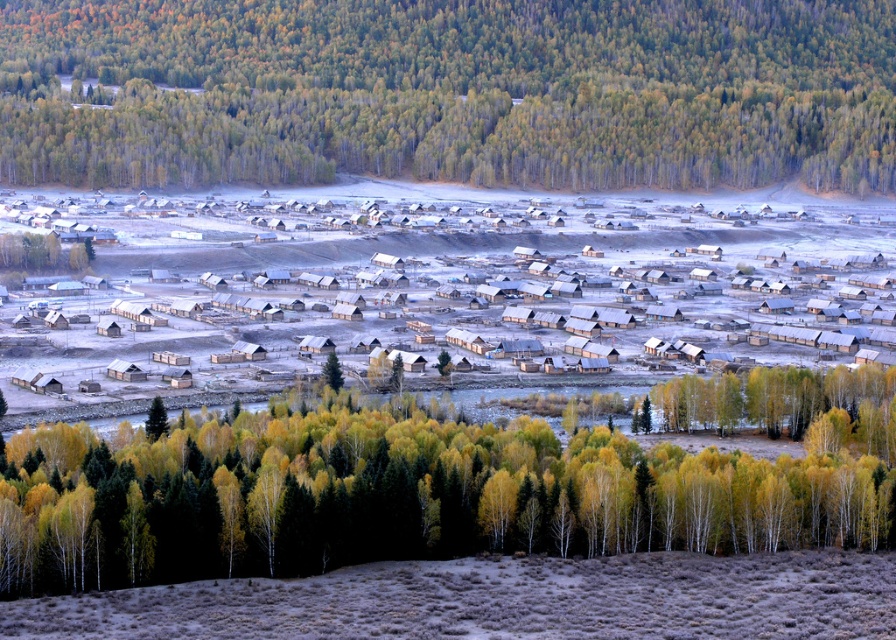
You are standing at the camera position and want to reach point (317,560). Is the distance more than 400 feet?

Yes, the distance between the camera and point (317,560) is 478.95 feet, which is more than 400 feet.

You are standing at the point labeled point (235, 545) and want to take a photo of the village. Is the point labeled point (842, 316) in the background or foreground of your photo?

The point labeled point (842, 316) is in the background of your photo because point (235, 545) is closer to the camera than point (842, 316).